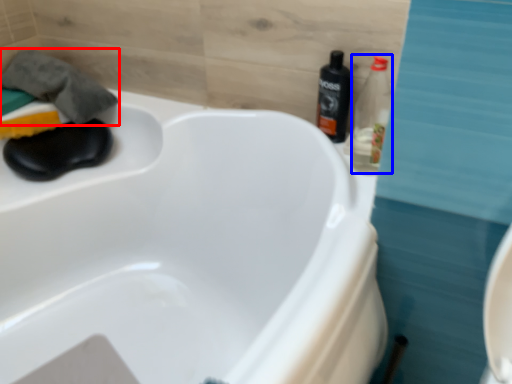
Question: Among these objects, which one is nearest to the camera, bath towel (highlighted by a red box) or bottle (highlighted by a blue box)?

Choices:
 (A) bath towel
 (B) bottle

Answer: (B)